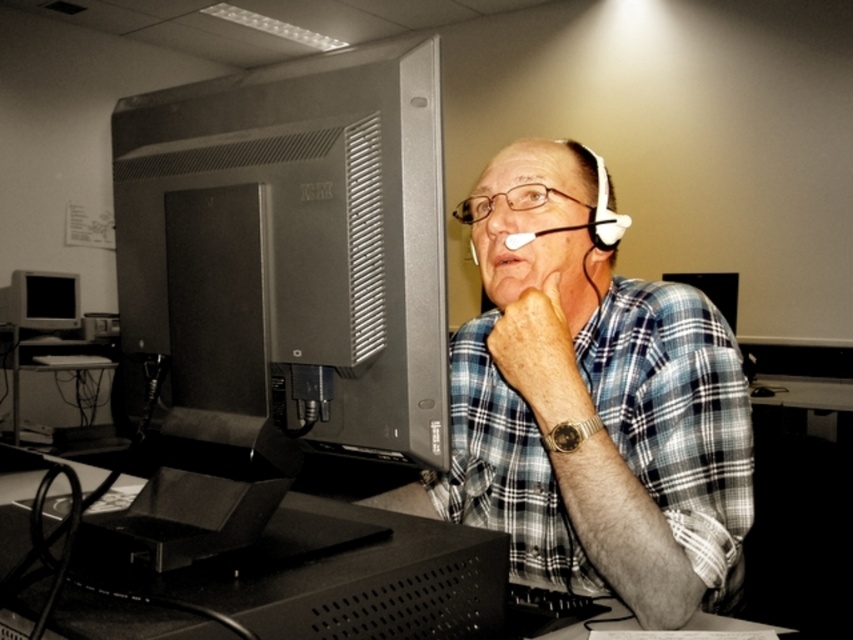
You are a photographer trying to capture a candid shot of the man in the scene. You notice the matte black monitor at left and the matte skin nose at center. Which object is taller and would require adjusting your camera angle to include both in the frame?

Answer: The matte black monitor at left is much taller than the matte skin nose at center. To include both in the frame, you would need to adjust your camera angle to account for the monitor being taller.